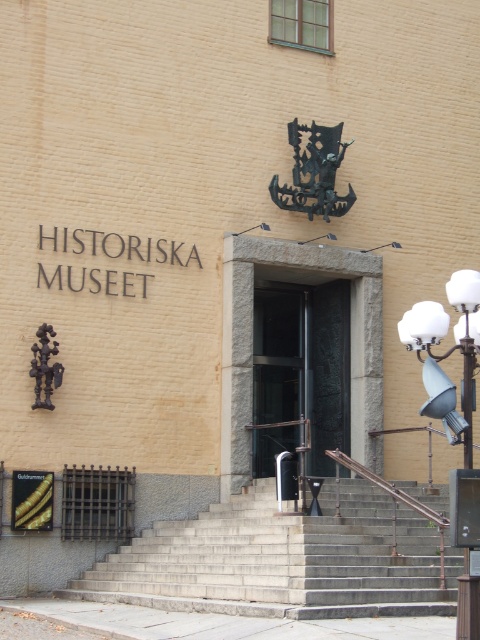
Which is more to the left, gray concrete stairs at center or transparent glass door at center?

gray concrete stairs at center is more to the left.

Can you confirm if gray concrete stairs at center is smaller than transparent glass door at center?

Incorrect, gray concrete stairs at center is not smaller in size than transparent glass door at center.

This screenshot has height=640, width=480. Find the location of `gray concrete stairs at center`. gray concrete stairs at center is located at coordinates (284, 561).

Who is positioned more to the right, gray concrete stairs at center or goldmetallicsign at lower left?

gray concrete stairs at center is more to the right.

Is gray concrete stairs at center to the left of goldmetallicsign at lower left from the viewer's perspective?

In fact, gray concrete stairs at center is to the right of goldmetallicsign at lower left.

Locate an element on the screen. gray concrete stairs at center is located at coordinates (284, 561).

Does transparent glass door at center have a greater width compared to goldmetallicsign at lower left?

Incorrect, transparent glass door at center's width does not surpass goldmetallicsign at lower left's.

Where is `transparent glass door at center`? This screenshot has height=640, width=480. transparent glass door at center is located at coordinates (304, 364).

Is point (304, 346) in front of point (46, 525)?

No, (304, 346) is further to viewer.

Find the location of a particular element. This screenshot has height=640, width=480. transparent glass door at center is located at coordinates (304, 364).